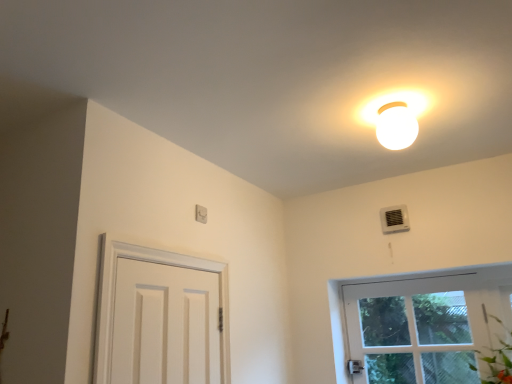
Question: From a real-world perspective, is white plastic air conditioner at upper right above or below white plastic light switch at upper center?

Choices:
 (A) above
 (B) below

Answer: (A)

Question: Which is correct: white plastic air conditioner at upper right is inside white plastic light switch at upper center, or outside of it?

Choices:
 (A) outside
 (B) inside

Answer: (A)

Question: Which object is positioned closest to the white plastic air conditioner at upper right?

Choices:
 (A) white plastic light switch at upper center
 (B) white glossy light fixture at upper center

Answer: (B)

Question: Which is farther from the white glossy light fixture at upper center?

Choices:
 (A) white plastic air conditioner at upper right
 (B) white plastic light switch at upper center

Answer: (B)